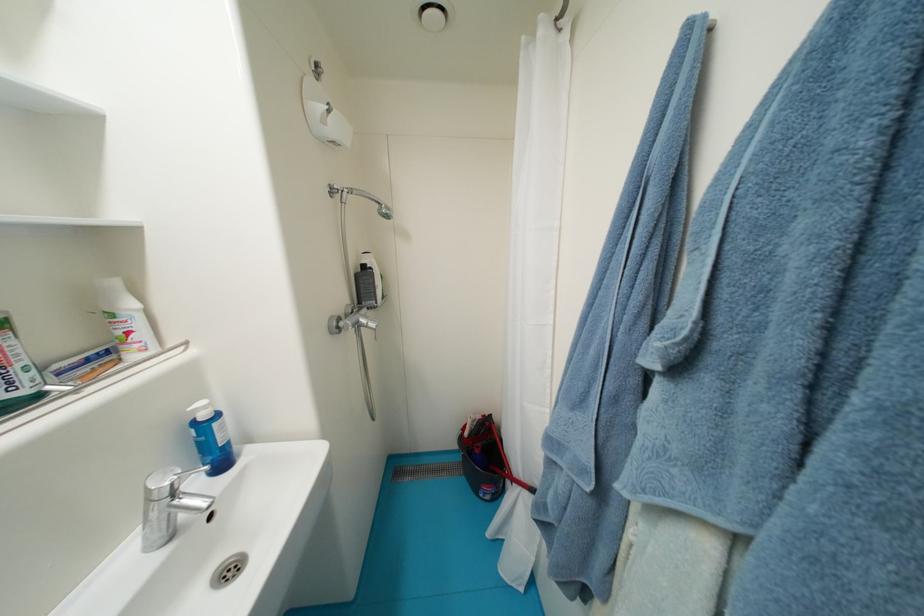
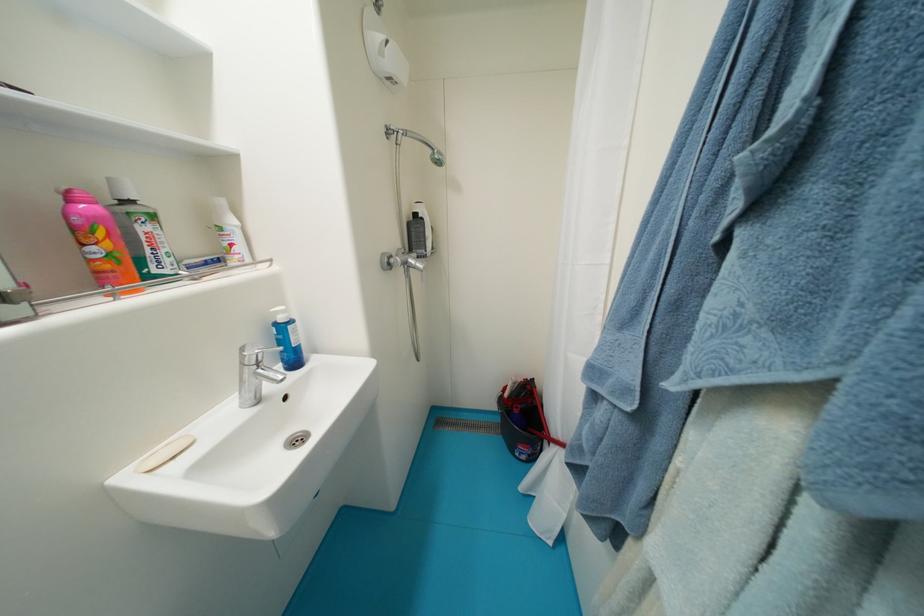
Question: Based on the continuous images, in which direction is the camera rotating? Reply with the corresponding letter.

Choices:
 (A) Left
 (B) Right
 (C) Up
 (D) Down

Answer: (A)